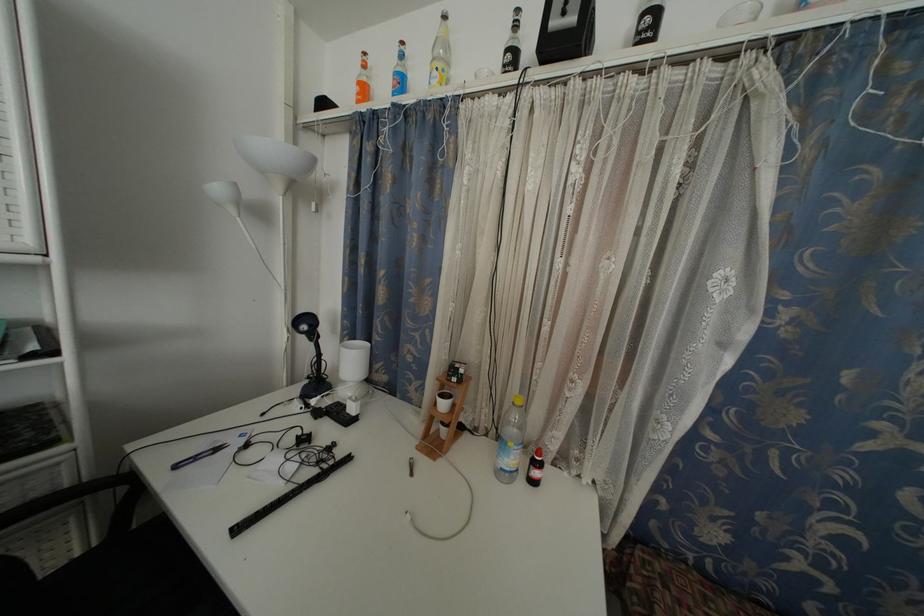
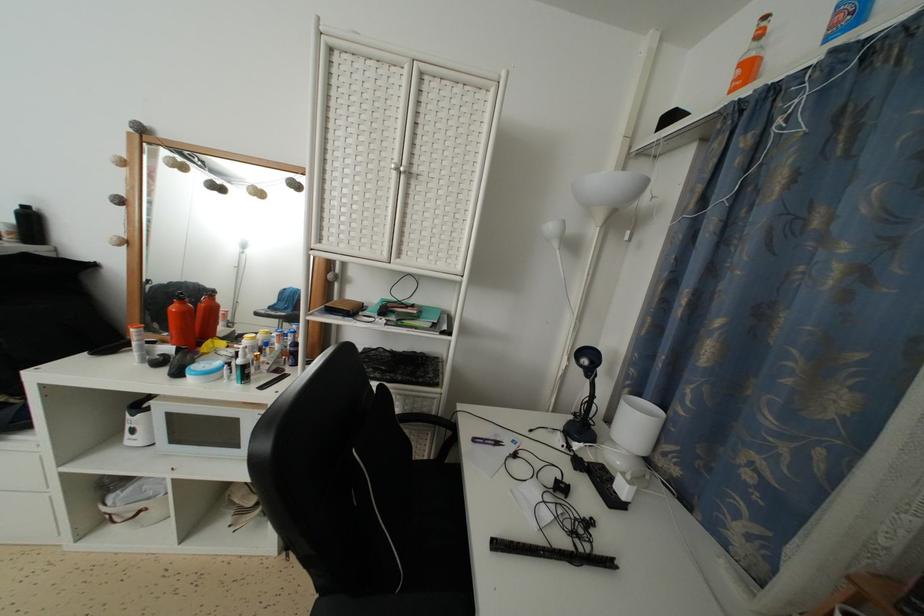
The point at (362, 89) is marked in the first image. Where is the corresponding point in the second image?

(746, 70)